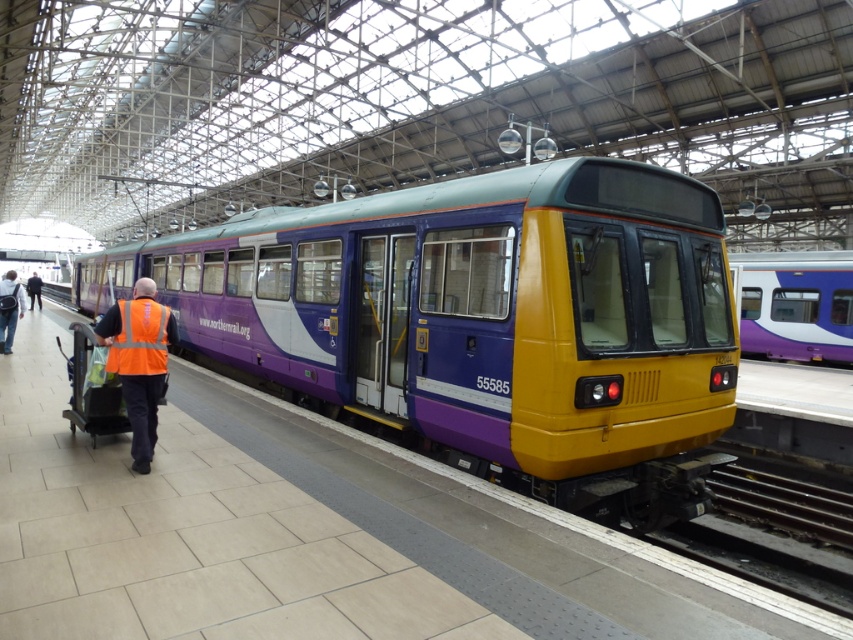
You are standing on the train station platform and want to locate the exact point marked at coordinates (138, 362). According to the scene, where would this point be located?

The point marked at coordinates (138, 362) is on the high visibility orange vest at center.

You are standing on the platform and need to locate the metallic steel train track at lower right. According to the coordinate system where the bottom left corner is the origin, can you confirm its position?

The metallic steel train track at lower right is located at coordinate point (772, 536).